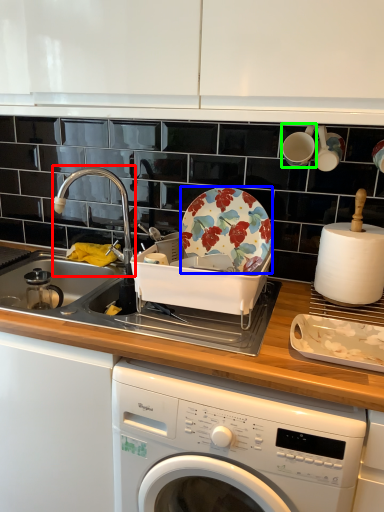
Question: Which object is positioned farthest from tap (highlighted by a red box)? Select from plate (highlighted by a blue box) and tableware (highlighted by a green box).

Choices:
 (A) plate
 (B) tableware

Answer: (B)